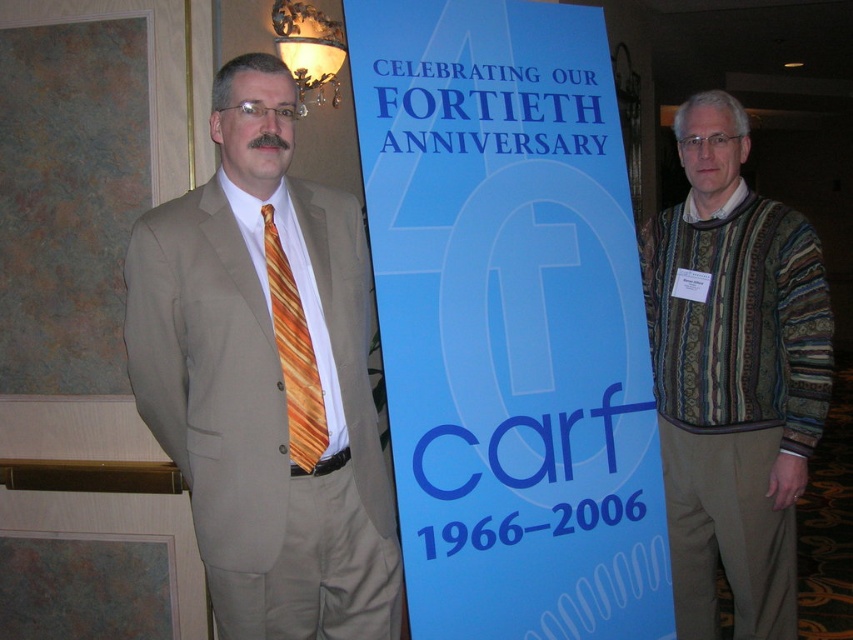
You are organizing an event and need to know the relative sizes of the blue paper sign at center and orange striped tie at left. Which object is larger?

The blue paper sign at center is bigger than the orange striped tie at left according to the description provided.

You are organizing a CARF anniversary event and need to place a decorative item on a table. The table has limited space. Which item should you choose between the blue paper sign at center and the striped sweater at right to ensure it fits better?

The striped sweater at right should be chosen because it is smaller in size than the blue paper sign at center, making it more suitable for limited space.